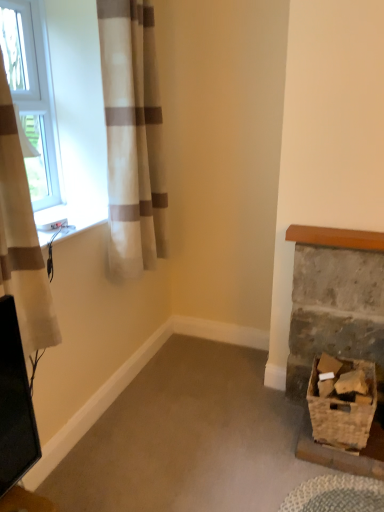
Question: From a real-world perspective, is rustic wooden basket at lower right positioned above or below white textured curtain at left, the second curtain when ordered from back to front?

Choices:
 (A) below
 (B) above

Answer: (A)

Question: Does point (362, 266) appear closer or farther from the camera than point (41, 280)?

Choices:
 (A) farther
 (B) closer

Answer: (A)

Question: Based on their relative distances, which object is farther from the white plastic window at upper left?

Choices:
 (A) white textured curtain at left, marked as the first curtain in a front-to-back arrangement
 (B) white sheer curtain at left, the first curtain from the back
 (C) woven brown basket at lower right
 (D) rustic wooden basket at lower right

Answer: (C)

Question: Estimate the real-world distances between objects in this image. Which object is farther from the white sheer curtain at left, the first curtain positioned from the right?

Choices:
 (A) white textured curtain at left, the second curtain when ordered from back to front
 (B) white plastic window at upper left
 (C) woven brown basket at lower right
 (D) rustic wooden basket at lower right

Answer: (C)